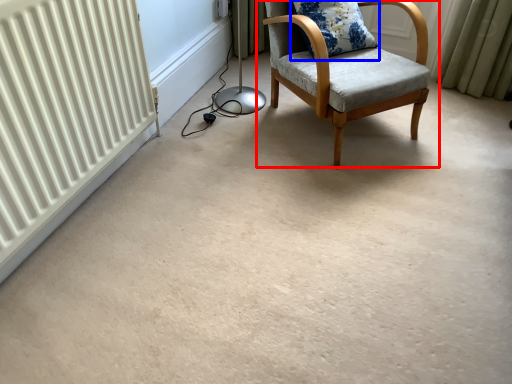
Question: Which object is closer to the camera taking this photo, chair (highlighted by a red box) or pillow (highlighted by a blue box)?

Choices:
 (A) chair
 (B) pillow

Answer: (A)